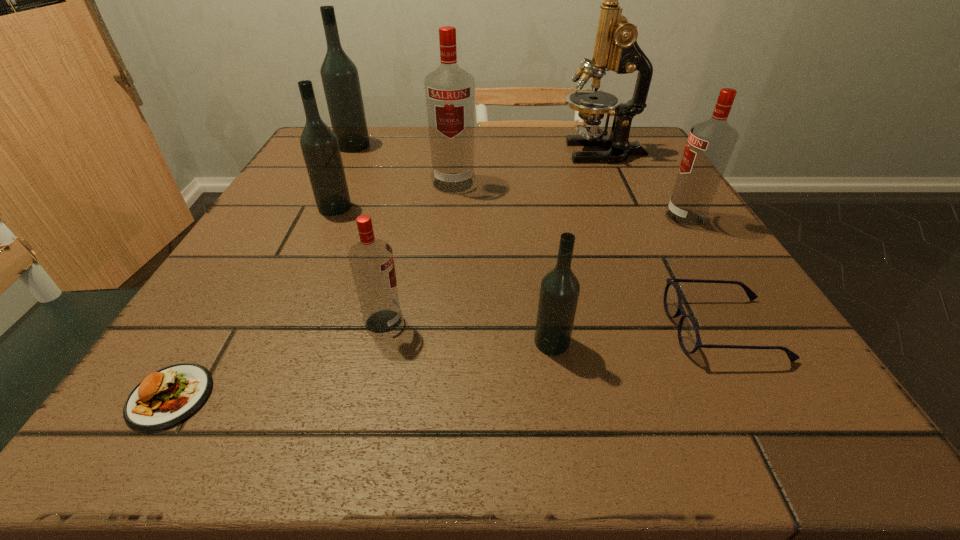
This screenshot has width=960, height=540. In order to click on vodka that is at the far edge in this screenshot , I will do `click(340, 79)`.

The width and height of the screenshot is (960, 540). I want to click on object present at the near edge, so click(x=164, y=398).

The image size is (960, 540). Find the location of `patty (food) that is at the left edge`. patty (food) that is at the left edge is located at coordinates (164, 398).

You are a GUI agent. You are given a task and a screenshot of the screen. Output one action in this format:
    pyautogui.click(x=<x>, y=<y>)
    Task: Click on the microscope that is at the right edge
    
    Given the screenshot: What is the action you would take?
    pyautogui.click(x=616, y=49)

Find the location of a particular element. vodka that is positioned at the right edge is located at coordinates (710, 144).

Identify the location of spectacles that is positioned at the right edge. This screenshot has height=540, width=960. (689, 338).

Where is `object situated at the far left corner`? object situated at the far left corner is located at coordinates (340, 79).

The image size is (960, 540). I want to click on object located at the near left corner, so click(164, 398).

Find the location of a particular element. The width and height of the screenshot is (960, 540). object that is at the far right corner is located at coordinates (616, 49).

In the image, there is a desktop. Where is `vacant area at the far edge`? Image resolution: width=960 pixels, height=540 pixels. vacant area at the far edge is located at coordinates (394, 169).